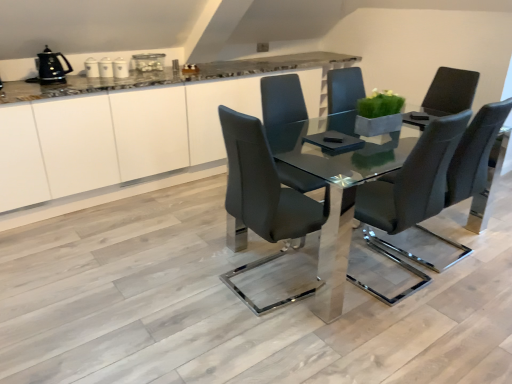
How much space does white glossy canister at upper center, placed as the 3th appliance when sorted from right to left, occupy horizontally?

16.95 centimeters.

How much space does white glossy canister at upper left, positioned as the fourth appliance in right-to-left order, occupy horizontally?

The width of white glossy canister at upper left, positioned as the fourth appliance in right-to-left order, is 4.46 inches.

This screenshot has height=384, width=512. What are the coordinates of `white glossy cabinetry at center` in the screenshot? It's located at (131, 136).

From the image's perspective, is matte black armchair at center on top of matte black chair at center, acting as the second chair starting from the left?

Yes, from the image's perspective, matte black armchair at center is over matte black chair at center, acting as the second chair starting from the left.

Is matte black chair at center, acting as the second chair starting from the left, at the back of matte black armchair at center?

No.

Is point (438, 70) closer or farther from the camera than point (365, 200)?

Clearly, point (438, 70) is more distant from the camera than point (365, 200).

In terms of height, does matte black armchair at center look taller or shorter compared to matte black chair at center, acting as the second chair starting from the left?

Considering their sizes, matte black armchair at center has less height than matte black chair at center, acting as the second chair starting from the left.

Is green matte planter at center positioned with its back to matte white vase at upper center, which ranks as the 5th appliance in left-to-right order?

Correct, green matte planter at center is looking away from matte white vase at upper center, which ranks as the 5th appliance in left-to-right order.

Is green matte planter at center at the left side of matte white vase at upper center, the first appliance when ordered from right to left?

In fact, green matte planter at center is to the right of matte white vase at upper center, the first appliance when ordered from right to left.

How different are the orientations of green matte planter at center and matte white vase at upper center, the first appliance when ordered from right to left, in degrees?

The facing directions of green matte planter at center and matte white vase at upper center, the first appliance when ordered from right to left, are 4.44 degrees apart.

Between green matte planter at center and matte white vase at upper center, the first appliance when ordered from right to left, which one has larger size?

green matte planter at center is bigger.

Which appliance is the 3rd one when counting from the back of the matte black chair at center, the first chair when ordered from right to left? Please provide its 2D coordinates.

[(91, 68)]

From the image's perspective, which is below, matte black chair at center, the first chair when ordered from right to left, or white glossy canister at upper left, positioned as the fourth appliance in right-to-left order?

From the image's view, matte black chair at center, the first chair when ordered from right to left, is below.

What's the angular difference between matte black chair at center, acting as the second chair starting from the left, and white glossy canister at upper left, acting as the second appliance starting from the left,'s facing directions?

The angular difference between matte black chair at center, acting as the second chair starting from the left, and white glossy canister at upper left, acting as the second appliance starting from the left, is 180 degrees.

Between matte black chair at center, acting as the second chair starting from the left, and white glossy canister at upper left, acting as the second appliance starting from the left, which one has smaller size?

white glossy canister at upper left, acting as the second appliance starting from the left.

Is black plastic kettle at upper left, the 5th appliance viewed from the right, oriented towards matte white vase at upper center, the first appliance when ordered from right to left?

No, black plastic kettle at upper left, the 5th appliance viewed from the right, does not turn towards matte white vase at upper center, the first appliance when ordered from right to left.

From the image's perspective, is black plastic kettle at upper left, the first appliance when ordered from left to right, on matte white vase at upper center, which ranks as the 5th appliance in left-to-right order?

Actually, black plastic kettle at upper left, the first appliance when ordered from left to right, appears below matte white vase at upper center, which ranks as the 5th appliance in left-to-right order, in the image.

The width and height of the screenshot is (512, 384). I want to click on appliance that is the 4th object located in front of the matte white vase at upper center, which ranks as the 5th appliance in left-to-right order, so click(50, 68).

In terms of width, does black plastic kettle at upper left, the 5th appliance viewed from the right, look wider or thinner when compared to matte white vase at upper center, the first appliance when ordered from right to left?

Considering their sizes, black plastic kettle at upper left, the 5th appliance viewed from the right, looks broader than matte white vase at upper center, the first appliance when ordered from right to left.

Is there a large distance between matte black armchair at center and matte black chair at center, which ranks as the 2th chair in right-to-left order?

Yes, matte black armchair at center is far from matte black chair at center, which ranks as the 2th chair in right-to-left order.

From the image's perspective, which is below, matte black armchair at center or matte black chair at center, arranged as the first chair when viewed from the left?

matte black chair at center, arranged as the first chair when viewed from the left, is shown below in the image.

Can we say matte black armchair at center lies outside matte black chair at center, which ranks as the 2th chair in right-to-left order?

Yes, matte black armchair at center is located beyond the bounds of matte black chair at center, which ranks as the 2th chair in right-to-left order.

Which point is more forward, (141, 54) or (122, 68)?

The point (122, 68) is closer to the camera.

In the scene shown: Do you think matte white vase at upper center, the first appliance when ordered from right to left, is within white glossy canisters at upper center, the 4th appliance viewed from the left, or outside of it?

Result: matte white vase at upper center, the first appliance when ordered from right to left, is spatially situated outside white glossy canisters at upper center, the 4th appliance viewed from the left.

Between matte white vase at upper center, the first appliance when ordered from right to left, and white glossy canisters at upper center, which is the second appliance from right to left, which one has larger size?

With larger size is matte white vase at upper center, the first appliance when ordered from right to left.

Can you confirm if black plastic kettle at upper left, the 5th appliance viewed from the right, is taller than white glossy canisters at upper center, which is the second appliance from right to left?

Yes, black plastic kettle at upper left, the 5th appliance viewed from the right, is taller than white glossy canisters at upper center, which is the second appliance from right to left.

Consider the image. From the image's perspective, is black plastic kettle at upper left, the first appliance when ordered from left to right, on white glossy canisters at upper center, the 4th appliance viewed from the left?

No, from the image's perspective, black plastic kettle at upper left, the first appliance when ordered from left to right, is not on top of white glossy canisters at upper center, the 4th appliance viewed from the left.

Could you measure the distance between black plastic kettle at upper left, the 5th appliance viewed from the right, and white glossy canisters at upper center, which is the second appliance from right to left?

17.02 inches.

Does black plastic kettle at upper left, the 5th appliance viewed from the right, lie in front of white glossy canisters at upper center, the 4th appliance viewed from the left?

Yes, black plastic kettle at upper left, the 5th appliance viewed from the right, is in front of white glossy canisters at upper center, the 4th appliance viewed from the left.

From the image's perspective, which chair is the 1st one below the matte black armchair at center? Please provide its 2D coordinates.

[(429, 185)]

Where is `the 1st appliance directly above the green matte planter at center (from a real-world perspective)`? This screenshot has width=512, height=384. the 1st appliance directly above the green matte planter at center (from a real-world perspective) is located at coordinates (148, 62).

Considering their positions, is green matte planter at center positioned closer to white glossy canisters at upper center, the 4th appliance viewed from the left, than matte black chair at center, acting as the second chair starting from the left?

green matte planter at center lies closer to white glossy canisters at upper center, the 4th appliance viewed from the left, than the other object.

Looking at the image, which one is located closer to white glossy canister at upper left, acting as the second appliance starting from the left, matte black armchair at center or black plastic kettle at upper left, the first appliance when ordered from left to right?

black plastic kettle at upper left, the first appliance when ordered from left to right, lies closer to white glossy canister at upper left, acting as the second appliance starting from the left, than the other object.

Looking at the image, which one is located closer to white glossy canister at upper center, placed as the 3th appliance when sorted from right to left, green matte planter at center or white glossy canister at upper left, acting as the second appliance starting from the left?

white glossy canister at upper left, acting as the second appliance starting from the left, is positioned closer to the anchor white glossy canister at upper center, placed as the 3th appliance when sorted from right to left.

When comparing their distances from matte black chair at center, the first chair when ordered from right to left, does matte white vase at upper center, the first appliance when ordered from right to left, or white glossy canisters at upper center, which is the second appliance from right to left, seem further?

Among the two, white glossy canisters at upper center, which is the second appliance from right to left, is located further to matte black chair at center, the first chair when ordered from right to left.

Which object lies further to the anchor point black plastic kettle at upper left, the first appliance when ordered from left to right, matte black chair at center, acting as the second chair starting from the left, or white glossy canisters at upper center, which is the second appliance from right to left?

The object further to black plastic kettle at upper left, the first appliance when ordered from left to right, is matte black chair at center, acting as the second chair starting from the left.

In the scene shown: Which object lies further to the anchor point black plastic kettle at upper left, the 5th appliance viewed from the right, white glossy canisters at upper center, which is the second appliance from right to left, or clear glass table at center?

Among the two, clear glass table at center is located further to black plastic kettle at upper left, the 5th appliance viewed from the right.

Based on their spatial positions, is matte black armchair at center or matte black chair at center, the first chair when ordered from right to left, closer to white glossy cabinetry at center?

matte black chair at center, the first chair when ordered from right to left, is closer to white glossy cabinetry at center.

Based on their spatial positions, is white glossy cabinetry at center or white glossy canisters at upper center, which is the second appliance from right to left, further from clear glass table at center?

white glossy canisters at upper center, which is the second appliance from right to left.

Where is `chair between white glossy canister at upper left, acting as the second appliance starting from the left, and green matte planter at center from left to right`? This screenshot has width=512, height=384. chair between white glossy canister at upper left, acting as the second appliance starting from the left, and green matte planter at center from left to right is located at coordinates (264, 197).

I want to click on chair located between clear glass table at center and matte black armchair at center in the depth direction, so click(429, 185).

Where is `cabinetry between matte black chair at center, which ranks as the 2th chair in right-to-left order, and white glossy canisters at upper center, the 4th appliance viewed from the left, along the z-axis`? cabinetry between matte black chair at center, which ranks as the 2th chair in right-to-left order, and white glossy canisters at upper center, the 4th appliance viewed from the left, along the z-axis is located at coordinates (131, 136).

Find the location of `cabinetry between black plastic kettle at upper left, the 5th appliance viewed from the right, and matte black chair at center, the first chair when ordered from right to left, from left to right`. cabinetry between black plastic kettle at upper left, the 5th appliance viewed from the right, and matte black chair at center, the first chair when ordered from right to left, from left to right is located at coordinates (131, 136).